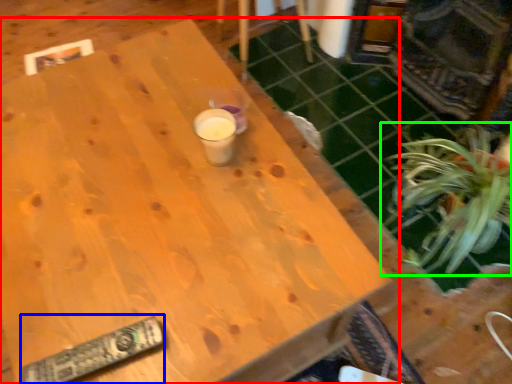
Question: Which object is the farthest from table (highlighted by a red box)? Choose among these: remote (highlighted by a blue box) or houseplant (highlighted by a green box).

Choices:
 (A) remote
 (B) houseplant

Answer: (B)